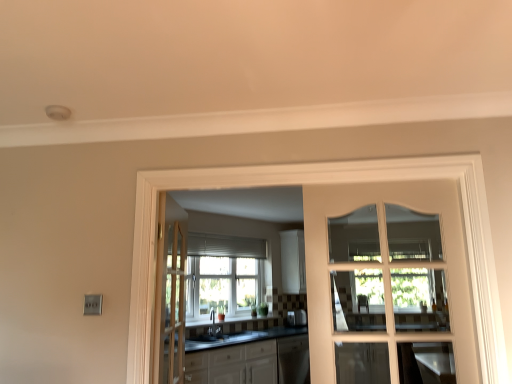
Question: Should I look upward or downward to see white glass door at center?

Choices:
 (A) down
 (B) up

Answer: (A)

Question: From the image's perspective, is white glass door at center, which is the second door in back-to-front order, on top of light brown wooden door at center, which is the 2th door in right-to-left order?

Choices:
 (A) yes
 (B) no

Answer: (A)

Question: Is white glass door at center, the first door from the right, positioned before light brown wooden door at center, which is the 1th door from left to right?

Choices:
 (A) yes
 (B) no

Answer: (A)

Question: Is white glass door at center, the first door from the right, located outside light brown wooden door at center, which is the 1th door from left to right?

Choices:
 (A) no
 (B) yes

Answer: (B)

Question: Would you say white glass door at center, which is the second door in back-to-front order, is a long distance from light brown wooden door at center, the first door when ordered from back to front?

Choices:
 (A) yes
 (B) no

Answer: (A)

Question: Is white glass door at center, which is the second door in back-to-front order, behind light brown wooden door at center, which is the 2th door in right-to-left order?

Choices:
 (A) yes
 (B) no

Answer: (B)

Question: From a real-world perspective, is white glass door at center, which is the second door in back-to-front order, on light brown wooden door at center, which ranks as the 2th door in front-to-back order?

Choices:
 (A) no
 (B) yes

Answer: (B)

Question: From a real-world perspective, is satin silver toaster at center positioned under matte black sink at center based on gravity?

Choices:
 (A) yes
 (B) no

Answer: (B)

Question: Does satin silver toaster at center appear on the left side of matte black sink at center?

Choices:
 (A) no
 (B) yes

Answer: (A)

Question: Is satin silver toaster at center at the right side of matte black sink at center?

Choices:
 (A) no
 (B) yes

Answer: (B)

Question: Is matte black sink at center completely or partially inside satin silver toaster at center?

Choices:
 (A) yes
 (B) no

Answer: (B)

Question: From the image's perspective, is satin silver toaster at center on matte black sink at center?

Choices:
 (A) yes
 (B) no

Answer: (B)

Question: Is satin silver toaster at center next to matte black sink at center and touching it?

Choices:
 (A) yes
 (B) no

Answer: (B)

Question: Is light brown wooden door at center, which is the 2th door in right-to-left order, not near white glossy cabinets at center?

Choices:
 (A) no
 (B) yes

Answer: (A)